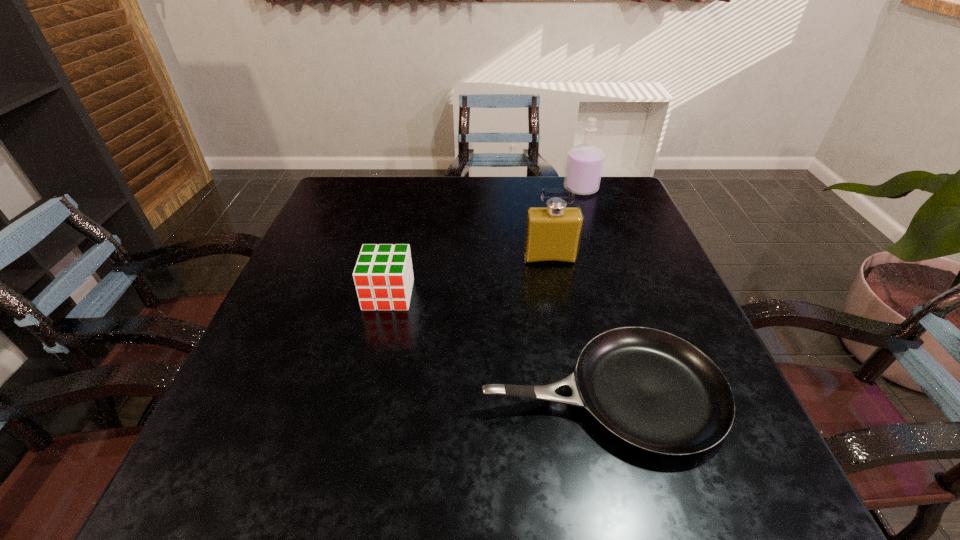
Where is `vacant space positioned on the red face of the second shortest object`? vacant space positioned on the red face of the second shortest object is located at coordinates (378, 340).

The width and height of the screenshot is (960, 540). I want to click on vacant point located 0.100m on the back of the pan, so click(x=580, y=302).

Identify the location of object that is at the far edge. This screenshot has width=960, height=540. (584, 166).

Where is `object located at the near edge`? This screenshot has height=540, width=960. object located at the near edge is located at coordinates (655, 391).

You are a GUI agent. You are given a task and a screenshot of the screen. Output one action in this format:
    pyautogui.click(x=<x>, y=<y>)
    Task: Click on the perfume that is at the right edge
    
    Given the screenshot: What is the action you would take?
    pyautogui.click(x=584, y=166)

Find the location of a particular element. pan present at the right edge is located at coordinates (655, 391).

Find the location of a particular element. The image size is (960, 540). object at the far right corner is located at coordinates (584, 166).

What are the coordinates of `object that is at the near right corner` in the screenshot? It's located at (655, 391).

This screenshot has width=960, height=540. What are the coordinates of `free space at the far edge of the desktop` in the screenshot? It's located at (473, 197).

At what (x,y) coordinates should I click in order to perform the action: click on free space at the near edge of the desktop. Please return your answer as a coordinate pair (x, y). Image resolution: width=960 pixels, height=540 pixels. Looking at the image, I should click on (372, 460).